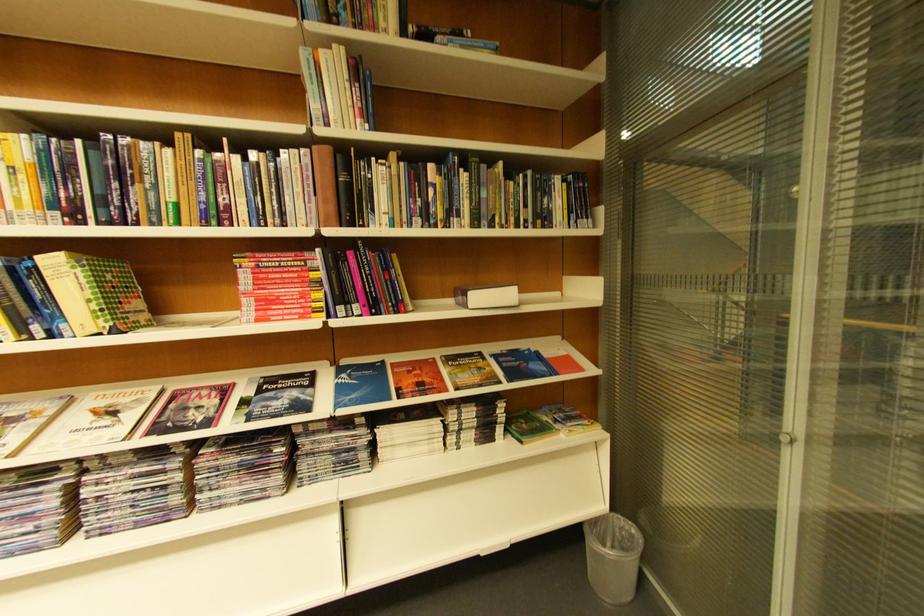
Find the location of a particular element. This screenshot has width=924, height=616. Forschung magazine is located at coordinates (188, 410).